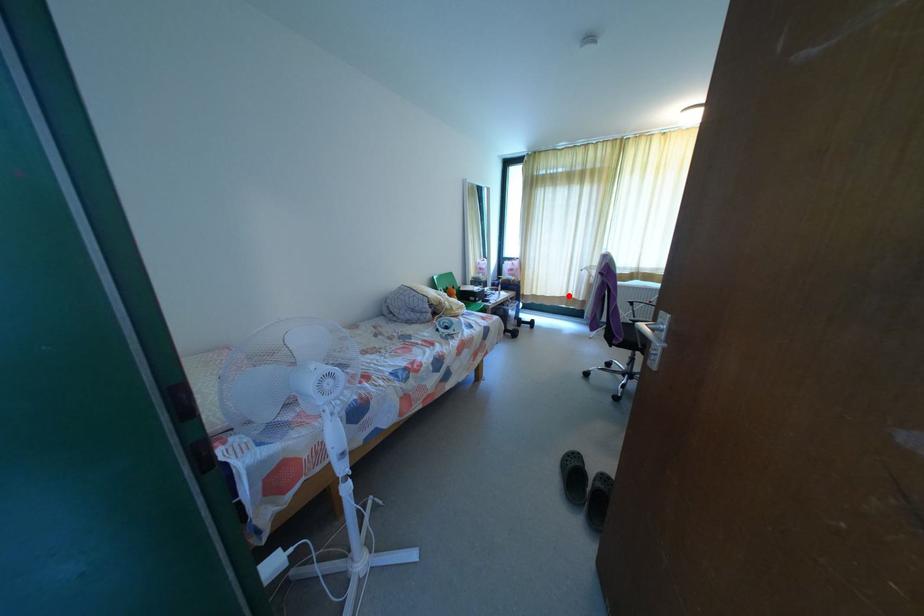
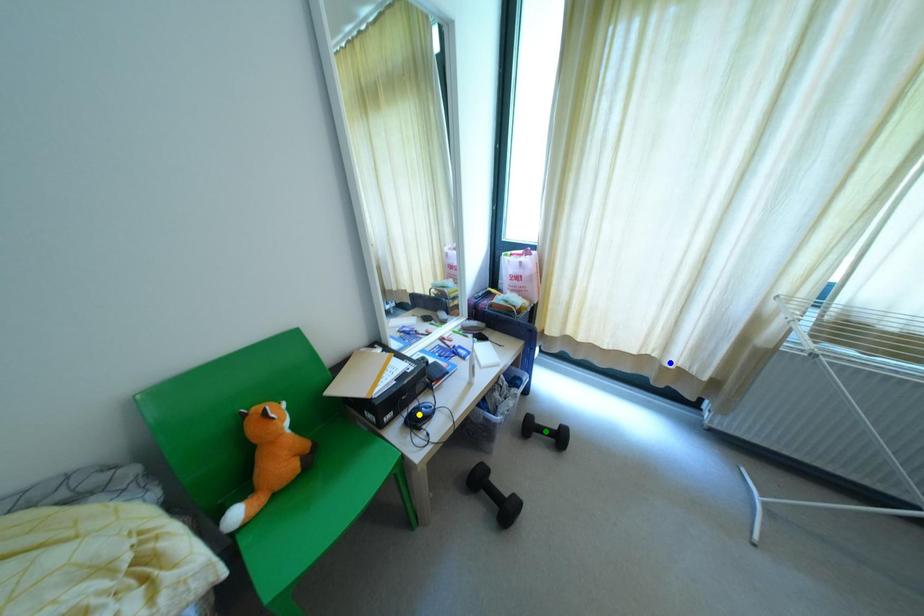
Question: I am providing you with two images of the same scene from different viewpoints. A red point is marked on the first image. You are given multiple points on the second image. Which point in image 2 is actually the same real-world point as the red point in image 1?

Choices:
 (A) yellow point
 (B) green point
 (C) blue point

Answer: (C)